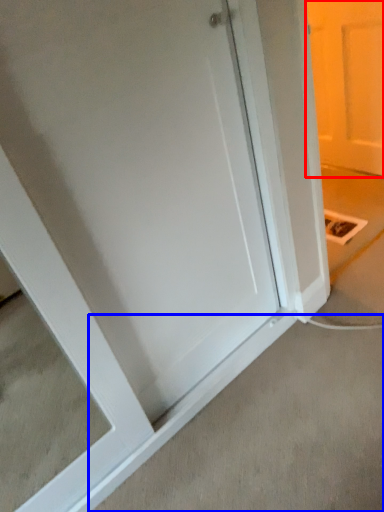
Question: Among these objects, which one is nearest to the camera, door (highlighted by a red box) or concrete (highlighted by a blue box)?

Choices:
 (A) door
 (B) concrete

Answer: (B)